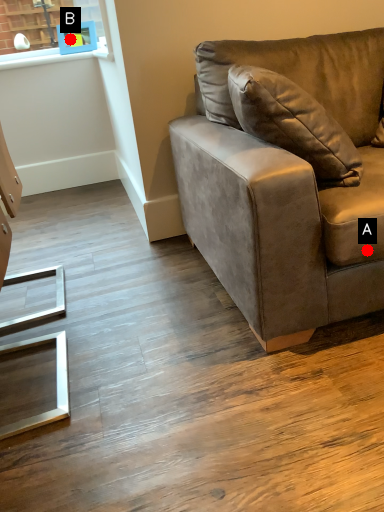
Question: Two points are circled on the image, labeled by A and B beside each circle. Which point appears closest to the camera in this image?

Choices:
 (A) A is closer
 (B) B is closer

Answer: (A)